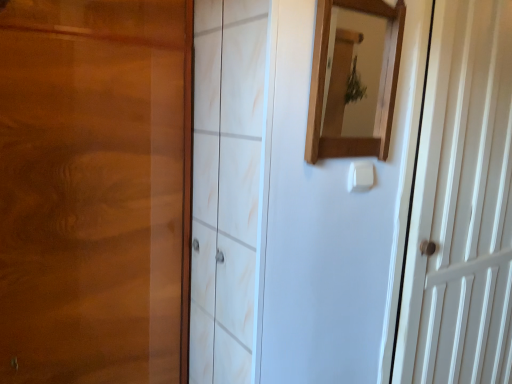
Question: Is wooden mirror at upper center smaller than white wooden door at right?

Choices:
 (A) no
 (B) yes

Answer: (B)

Question: From the image's perspective, would you say wooden mirror at upper center is shown under white wooden door at right?

Choices:
 (A) yes
 (B) no

Answer: (B)

Question: Does wooden mirror at upper center have a lesser height compared to white wooden door at right?

Choices:
 (A) yes
 (B) no

Answer: (A)

Question: Considering the relative sizes of wooden mirror at upper center and white wooden door at right in the image provided, is wooden mirror at upper center thinner than white wooden door at right?

Choices:
 (A) no
 (B) yes

Answer: (B)

Question: Is wooden mirror at upper center oriented away from white wooden door at right?

Choices:
 (A) yes
 (B) no

Answer: (B)

Question: From the image's perspective, is wooden mirror at upper center located above white wooden door at right?

Choices:
 (A) yes
 (B) no

Answer: (A)

Question: Is white plastic light switch at center not inside wooden mirror at upper center?

Choices:
 (A) yes
 (B) no

Answer: (A)

Question: From the image's perspective, is white plastic light switch at center on top of wooden mirror at upper center?

Choices:
 (A) yes
 (B) no

Answer: (B)

Question: Considering the relative sizes of white plastic light switch at center and wooden mirror at upper center in the image provided, is white plastic light switch at center smaller than wooden mirror at upper center?

Choices:
 (A) yes
 (B) no

Answer: (A)

Question: Is white plastic light switch at center in front of wooden mirror at upper center?

Choices:
 (A) no
 (B) yes

Answer: (A)

Question: Is white plastic light switch at center further to the viewer compared to wooden mirror at upper center?

Choices:
 (A) no
 (B) yes

Answer: (B)

Question: Is white plastic light switch at center to the right of wooden mirror at upper center from the viewer's perspective?

Choices:
 (A) no
 (B) yes

Answer: (B)

Question: Is white wooden door at right not near wooden mirror at upper center?

Choices:
 (A) yes
 (B) no

Answer: (B)